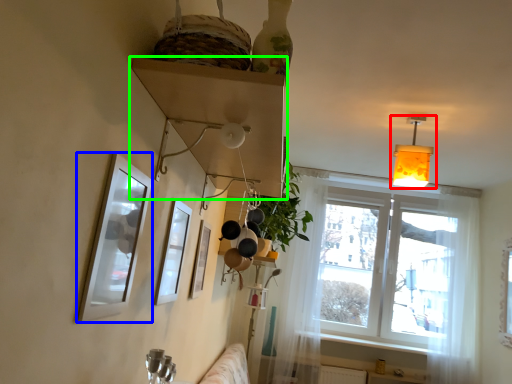
Question: Considering the real-world distances, which object is closest to lamp (highlighted by a red box)? picture frame (highlighted by a blue box) or shelf (highlighted by a green box).

Choices:
 (A) picture frame
 (B) shelf

Answer: (B)